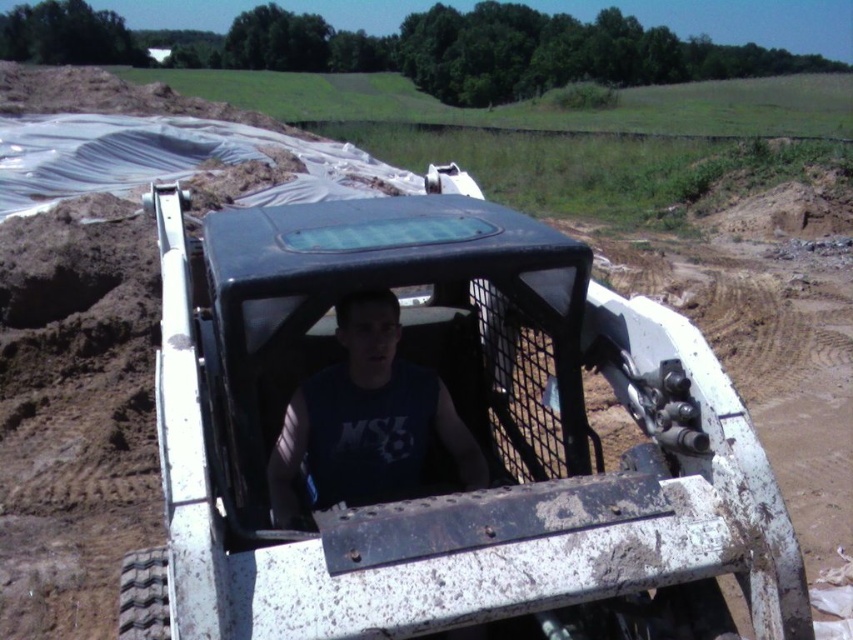
Between white matte skid steer at center and matte black tank top at center, which one appears on the left side from the viewer's perspective?

matte black tank top at center

Does point (300, 477) come in front of point (448, 438)?

Yes, point (300, 477) is closer to viewer.

Locate an element on the screen. This screenshot has width=853, height=640. white matte skid steer at center is located at coordinates (439, 438).